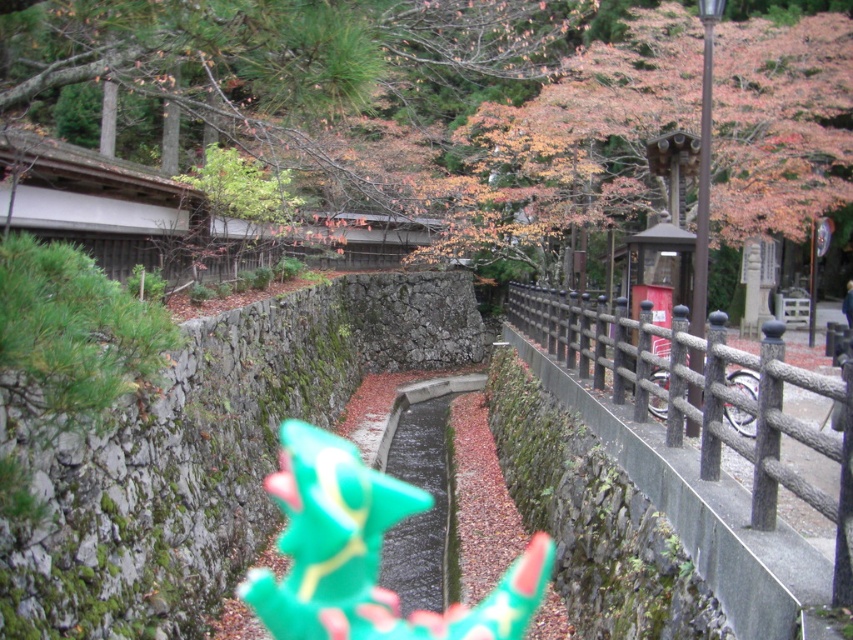
Can you confirm if autumn leaves at upper center is wider than smooth gray fence at center right?

Yes, autumn leaves at upper center is wider than smooth gray fence at center right.

Is autumn leaves at upper center thinner than smooth gray fence at center right?

Incorrect, autumn leaves at upper center's width is not less than smooth gray fence at center right's.

The image size is (853, 640). I want to click on autumn leaves at upper center, so click(381, 97).

Locate an element on the screen. The width and height of the screenshot is (853, 640). autumn leaves at upper center is located at coordinates (381, 97).

Which is below, smooth gray fence at center right or green plastic toy at center?

Positioned lower is green plastic toy at center.

Consider the image. Is smooth gray fence at center right wider than green plastic toy at center?

Indeed, smooth gray fence at center right has a greater width compared to green plastic toy at center.

Is point (718, 461) closer to viewer compared to point (305, 474)?

Yes, it is in front of point (305, 474).

Where is `smooth gray fence at center right`? The width and height of the screenshot is (853, 640). smooth gray fence at center right is located at coordinates (703, 448).

In the scene shown: Can you confirm if autumn leaves at upper center is positioned below green plastic toy at center?

No.

Is point (403, 49) behind point (451, 618)?

That is True.

The width and height of the screenshot is (853, 640). Identify the location of autumn leaves at upper center. click(381, 97).